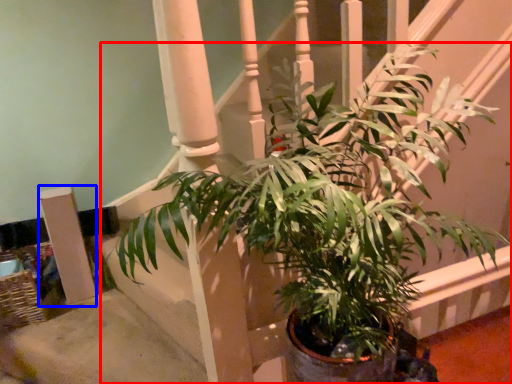
Question: Which point is further to the camera, houseplant (highlighted by a red box) or pillar (highlighted by a blue box)?

Choices:
 (A) houseplant
 (B) pillar

Answer: (B)